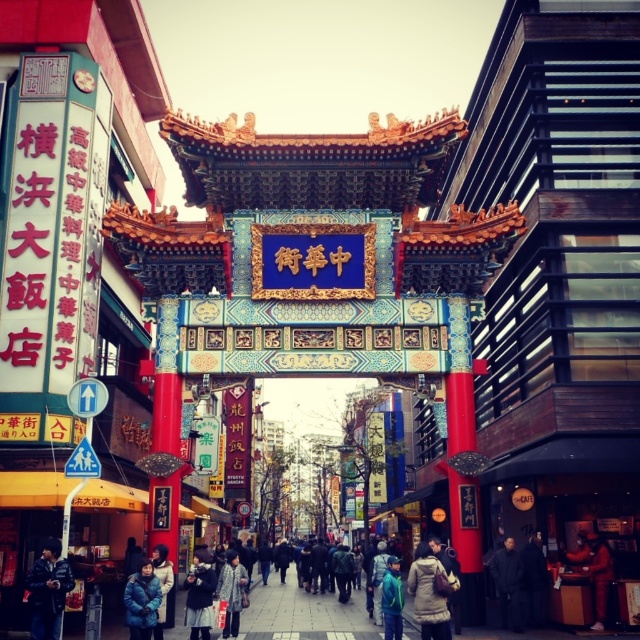
Question: Can you confirm if dark blue jacket at center is thinner than blue fabric jacket at lower center?

Choices:
 (A) no
 (B) yes

Answer: (A)

Question: Among these objects, which one is farthest from the camera?

Choices:
 (A) matte brown coat at center
 (B) orange fabric jacket at center

Answer: (B)

Question: Does concrete sidewalk at center appear on the left side of blue fuzzy coat at lower left?

Choices:
 (A) no
 (B) yes

Answer: (A)

Question: Does dark blue jacket at lower left lie behind patterned fabric coat at center?

Choices:
 (A) no
 (B) yes

Answer: (A)

Question: Which object is positioned closest to the blue fuzzy coat at lower left?

Choices:
 (A) light blue denim jacket at lower center
 (B) orange fabric jacket at center

Answer: (A)

Question: Which point is closer to the camera taking this photo?

Choices:
 (A) (132, 582)
 (B) (422, 627)
 (C) (196, 611)
 (D) (401, 618)

Answer: (B)